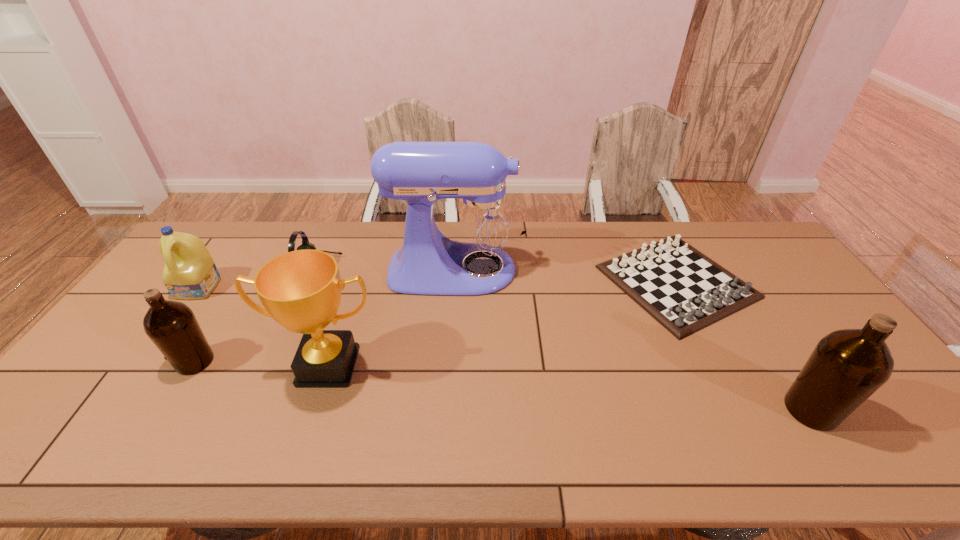
You are a GUI agent. You are given a task and a screenshot of the screen. Output one action in this format:
    pyautogui.click(x=<x>, y=<y>)
    Task: Click on the blank area in the image that satisfies the following two spatial constraints: 1. at the mixing area of the chessboard; 2. on the right side of the tallest object
    
    Given the screenshot: What is the action you would take?
    pyautogui.click(x=456, y=282)